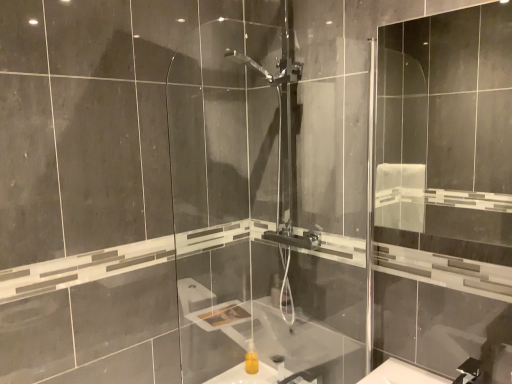
In order to face transparent glass shower door at center, the 1th screen door from the left, should I rotate leftwards or rightwards?

Rotate right and turn 6.375 degrees.

You are a GUI agent. You are given a task and a screenshot of the screen. Output one action in this format:
    pyautogui.click(x=<x>, y=<y>)
    Task: Click on the yellow matte sink at center
    This screenshot has width=512, height=384.
    Given the screenshot: What is the action you would take?
    pyautogui.click(x=262, y=373)

What are the coordinates of `sink on the left of transparent glass screen door at right, positioned as the second screen door in left-to-right order` in the screenshot? It's located at (262, 373).

From a real-world perspective, which is physically below, transparent glass screen door at right, positioned as the second screen door in left-to-right order, or yellow matte sink at center?

yellow matte sink at center is physically lower.

Measure the distance between transparent glass screen door at right, positioned as the second screen door in left-to-right order, and yellow matte sink at center.

1.57 meters.

Consider the image. Do you think transparent glass screen door at right, the first screen door positioned from the right, is within yellow matte sink at center, or outside of it?

transparent glass screen door at right, the first screen door positioned from the right, is outside yellow matte sink at center.

Considering the points (314, 381) and (237, 311), which point is behind, point (314, 381) or point (237, 311)?

The point (237, 311) is behind.

Considering the relative sizes of yellow matte sink at center and transparent glass shower door at center, which is the 2th screen door in right-to-left order, in the image provided, is yellow matte sink at center bigger than transparent glass shower door at center, which is the 2th screen door in right-to-left order,?

No, yellow matte sink at center is not bigger than transparent glass shower door at center, which is the 2th screen door in right-to-left order.

Looking at this image, measure the distance between yellow matte sink at center and transparent glass shower door at center, the 1th screen door from the left.

They are 24.10 inches apart.

Considering the relative sizes of yellow matte sink at center and transparent glass shower door at center, which is the 2th screen door in right-to-left order, in the image provided, is yellow matte sink at center wider than transparent glass shower door at center, which is the 2th screen door in right-to-left order,?

Yes, yellow matte sink at center is wider than transparent glass shower door at center, which is the 2th screen door in right-to-left order.

From the image's perspective, between transparent glass screen door at right, the first screen door positioned from the right, and transparent glass shower door at center, the 1th screen door from the left, which one is located above?

transparent glass screen door at right, the first screen door positioned from the right, appears higher in the image.

Is transparent glass screen door at right, the first screen door positioned from the right, at the left side of transparent glass shower door at center, the 1th screen door from the left?

No, transparent glass screen door at right, the first screen door positioned from the right, is not to the left of transparent glass shower door at center, the 1th screen door from the left.

Locate an element on the screen. screen door that is under the transparent glass screen door at right, positioned as the second screen door in left-to-right order (from a real-world perspective) is located at coordinates (267, 198).

Does transparent glass shower door at center, which is the 2th screen door in right-to-left order, have a greater height compared to yellow matte sink at center?

Indeed, transparent glass shower door at center, which is the 2th screen door in right-to-left order, has a greater height compared to yellow matte sink at center.

Would you consider transparent glass shower door at center, which is the 2th screen door in right-to-left order, to be distant from yellow matte sink at center?

No, there isn't a large distance between transparent glass shower door at center, which is the 2th screen door in right-to-left order, and yellow matte sink at center.

From a real-world perspective, is transparent glass shower door at center, the 1th screen door from the left, physically located above or below yellow matte sink at center?

transparent glass shower door at center, the 1th screen door from the left, is above yellow matte sink at center.

Can we say transparent glass shower door at center, which is the 2th screen door in right-to-left order, lies outside yellow matte sink at center?

Yes, transparent glass shower door at center, which is the 2th screen door in right-to-left order, is not within yellow matte sink at center.

Considering the relative sizes of yellow matte sink at center and transparent glass screen door at right, the first screen door positioned from the right, in the image provided, is yellow matte sink at center thinner than transparent glass screen door at right, the first screen door positioned from the right,?

No.

Identify the location of sink that appears on the left of transparent glass screen door at right, positioned as the second screen door in left-to-right order. The height and width of the screenshot is (384, 512). (262, 373).

From the image's perspective, is yellow matte sink at center on top of transparent glass screen door at right, the first screen door positioned from the right?

No.

Consider the image. Which point is more forward, (278, 345) or (407, 177)?

Positioned in front is point (278, 345).

Between transparent glass shower door at center, the 1th screen door from the left, and transparent glass screen door at right, the first screen door positioned from the right, which one has larger size?

With larger size is transparent glass shower door at center, the 1th screen door from the left.

Find the location of a particular element. The height and width of the screenshot is (384, 512). screen door on the right of transparent glass shower door at center, the 1th screen door from the left is located at coordinates (445, 192).

Looking at this image, is transparent glass shower door at center, the 1th screen door from the left, far away from transparent glass screen door at right, positioned as the second screen door in left-to-right order?

That's right, there is a large distance between transparent glass shower door at center, the 1th screen door from the left, and transparent glass screen door at right, positioned as the second screen door in left-to-right order.

The image size is (512, 384). Find the location of `the 2nd screen door counting from the right side of the yellow matte sink at center`. the 2nd screen door counting from the right side of the yellow matte sink at center is located at coordinates (445, 192).

You are a GUI agent. You are given a task and a screenshot of the screen. Output one action in this format:
    pyautogui.click(x=<x>, y=<y>)
    Task: Click on the sink that appears behind the transparent glass shower door at center, which is the 2th screen door in right-to-left order
    The image size is (512, 384).
    Given the screenshot: What is the action you would take?
    pyautogui.click(x=262, y=373)

Considering their positions, is transparent glass shower door at center, the 1th screen door from the left, positioned closer to transparent glass screen door at right, positioned as the second screen door in left-to-right order, than yellow matte sink at center?

The object closer to transparent glass screen door at right, positioned as the second screen door in left-to-right order, is transparent glass shower door at center, the 1th screen door from the left.

Estimate the real-world distances between objects in this image. Which object is further from transparent glass shower door at center, the 1th screen door from the left, yellow matte sink at center or transparent glass screen door at right, the first screen door positioned from the right?

transparent glass screen door at right, the first screen door positioned from the right, is positioned further to the anchor transparent glass shower door at center, the 1th screen door from the left.

Considering their positions, is transparent glass screen door at right, positioned as the second screen door in left-to-right order, positioned closer to transparent glass shower door at center, the 1th screen door from the left, than yellow matte sink at center?

yellow matte sink at center.

From the image, which object appears to be nearer to transparent glass screen door at right, the first screen door positioned from the right, yellow matte sink at center or transparent glass shower door at center, the 1th screen door from the left?

The object closer to transparent glass screen door at right, the first screen door positioned from the right, is transparent glass shower door at center, the 1th screen door from the left.

Based on their spatial positions, is transparent glass shower door at center, which is the 2th screen door in right-to-left order, or transparent glass screen door at right, positioned as the second screen door in left-to-right order, closer to yellow matte sink at center?

transparent glass shower door at center, which is the 2th screen door in right-to-left order.

Considering their positions, is transparent glass screen door at right, the first screen door positioned from the right, positioned closer to yellow matte sink at center than transparent glass shower door at center, the 1th screen door from the left?

The object closer to yellow matte sink at center is transparent glass shower door at center, the 1th screen door from the left.

Identify the location of screen door between transparent glass screen door at right, the first screen door positioned from the right, and yellow matte sink at center vertically. Image resolution: width=512 pixels, height=384 pixels. (267, 198).